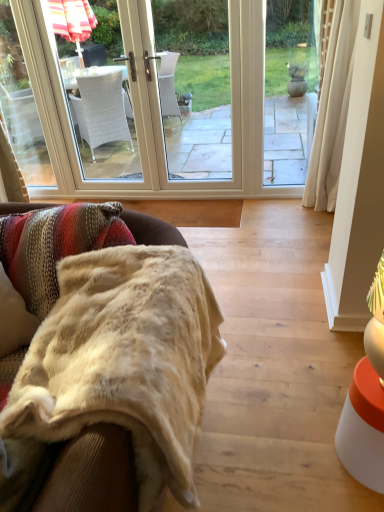
Question: Should I look upward or downward to see beige plush blanket at lower left?

Choices:
 (A) up
 (B) down

Answer: (B)